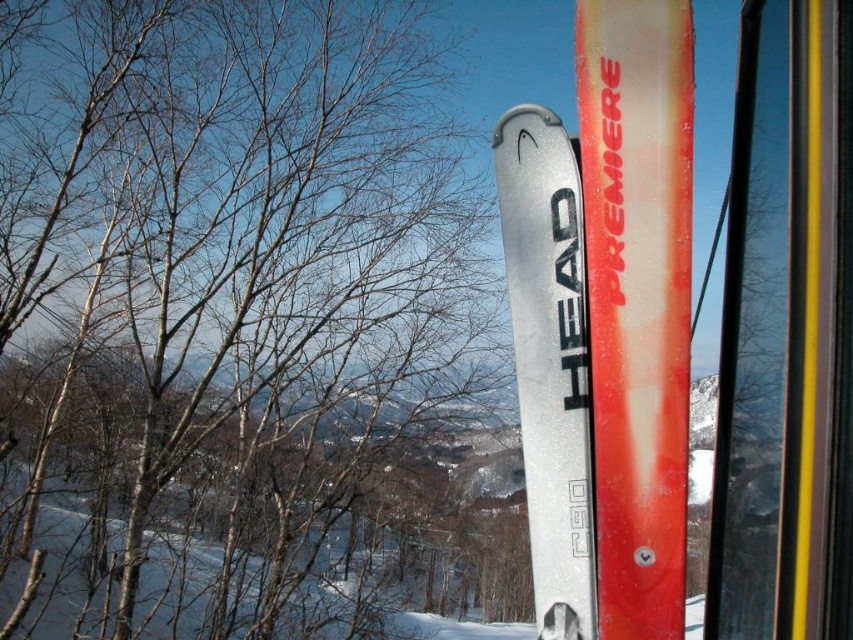
You are a photographer taking a winter landscape photo from inside a ski lift cabin. You notice the bare branches at upper left and the satin silver ski at center. Which object is positioned lower in the image?

The bare branches at upper left are positioned below the satin silver ski at center, so the bare branches at upper left are lower in the image.

You are a photographer trying to capture the winter scene through the ski lift cabin window. You notice the bare branches at upper left and the satin silver ski at center. Which object would appear closer to the camera in the photo?

The satin silver ski at center would appear closer to the camera because it is larger than the bare branches at upper left, as objects closer to the camera generally appear larger in the photo.